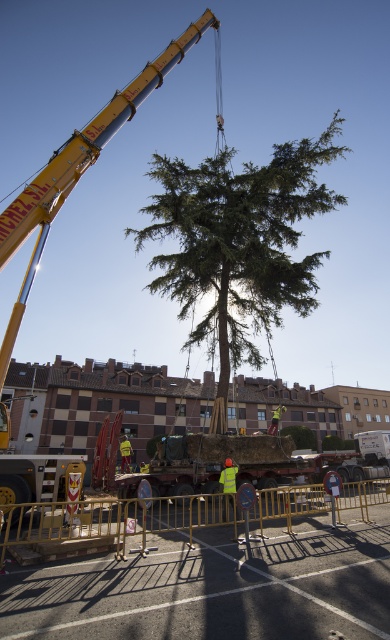
Does green textured tree at center appear under yellow metallic crane at upper center?

Indeed, green textured tree at center is positioned under yellow metallic crane at upper center.

Which is in front, point (317, 266) or point (24, 193)?

Positioned in front is point (24, 193).

You are a GUI agent. You are given a task and a screenshot of the screen. Output one action in this format:
    pyautogui.click(x=<x>, y=<y>)
    Task: Click on the green textured tree at center
    The width and height of the screenshot is (390, 640).
    Given the screenshot: What is the action you would take?
    pyautogui.click(x=239, y=243)

Does gold metallic barricade at lower center have a lesser width compared to yellow metallic crane at upper center?

Incorrect, gold metallic barricade at lower center's width is not less than yellow metallic crane at upper center's.

In the scene shown: Is gold metallic barricade at lower center positioned before yellow metallic crane at upper center?

Yes, gold metallic barricade at lower center is in front of yellow metallic crane at upper center.

The height and width of the screenshot is (640, 390). Describe the element at coordinates (113, 518) in the screenshot. I see `gold metallic barricade at lower center` at that location.

Find the location of `gold metallic barricade at lower center`. gold metallic barricade at lower center is located at coordinates coord(113,518).

Does green textured tree at center have a lesser height compared to gold metallic barricade at lower center?

In fact, green textured tree at center may be taller than gold metallic barricade at lower center.

Between green textured tree at center and gold metallic barricade at lower center, which one has more height?

Standing taller between the two is green textured tree at center.

Between point (173, 289) and point (125, 545), which one is positioned in front?

Point (125, 545)

Locate an element on the screen. This screenshot has height=640, width=390. green textured tree at center is located at coordinates (x=239, y=243).